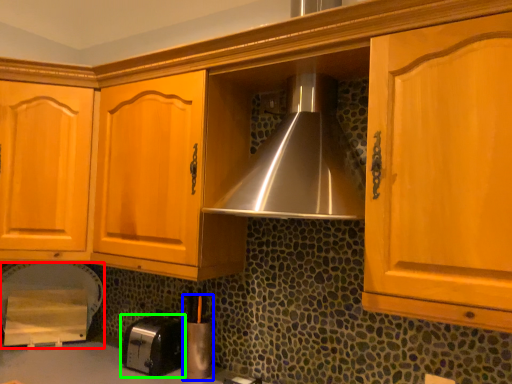
Question: Which object is the closest to the appliance (highlighted by a red box)? Choose among these: appliance (highlighted by a blue box) or toaster (highlighted by a green box).

Choices:
 (A) appliance
 (B) toaster

Answer: (B)